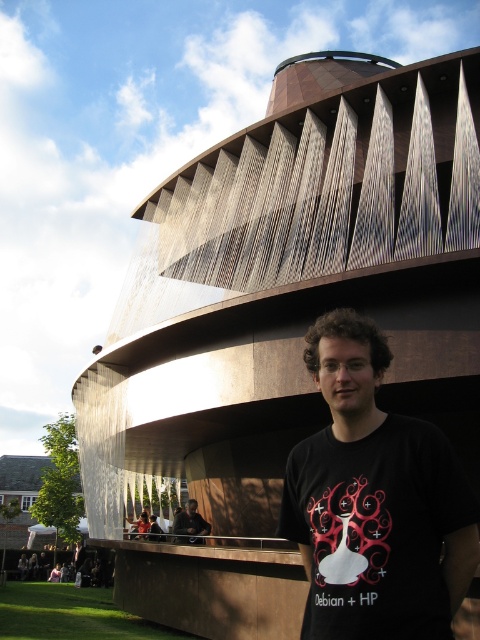
Question: Is black matte t-shirt at center bigger than dark brown leather jacket at lower center?

Choices:
 (A) yes
 (B) no

Answer: (A)

Question: Does black matte t-shirt at center lie in front of dark brown leather jacket at lower center?

Choices:
 (A) no
 (B) yes

Answer: (B)

Question: Is black matte t-shirt at center smaller than dark brown leather jacket at lower center?

Choices:
 (A) yes
 (B) no

Answer: (B)

Question: Among these objects, which one is farthest from the camera?

Choices:
 (A) dark brown leather jacket at lower center
 (B) black matte t-shirt at center

Answer: (A)